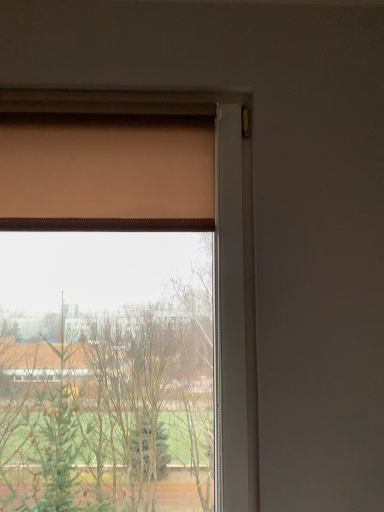
At what (x,y) coordinates should I click in order to perform the action: click on matte brown curtain at upper left. Please return your answer as a coordinate pair (x, y). Image resolution: width=384 pixels, height=512 pixels. Looking at the image, I should click on (106, 169).

The height and width of the screenshot is (512, 384). Describe the element at coordinates (106, 169) in the screenshot. I see `matte brown curtain at upper left` at that location.

Find the location of `matte brown curtain at upper left`. matte brown curtain at upper left is located at coordinates (106, 169).